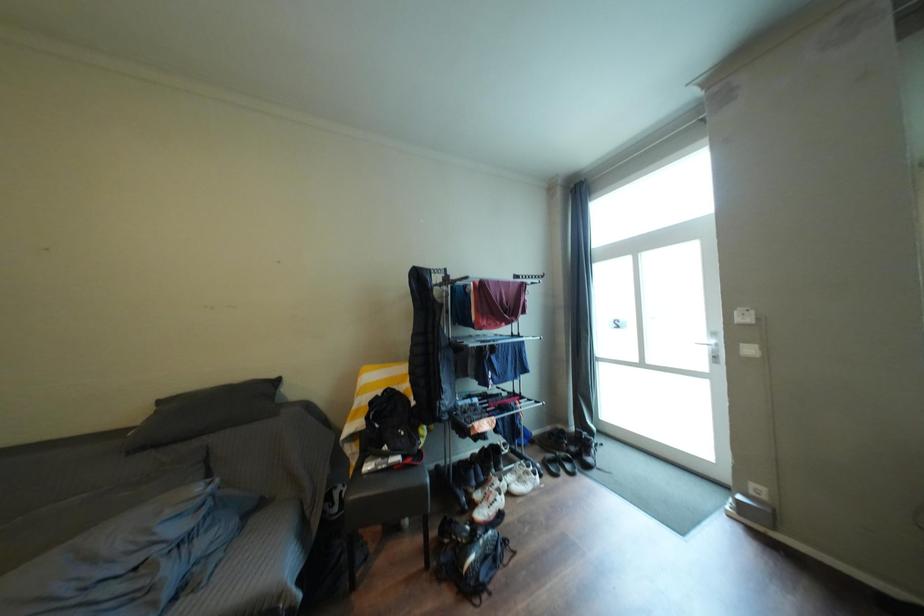
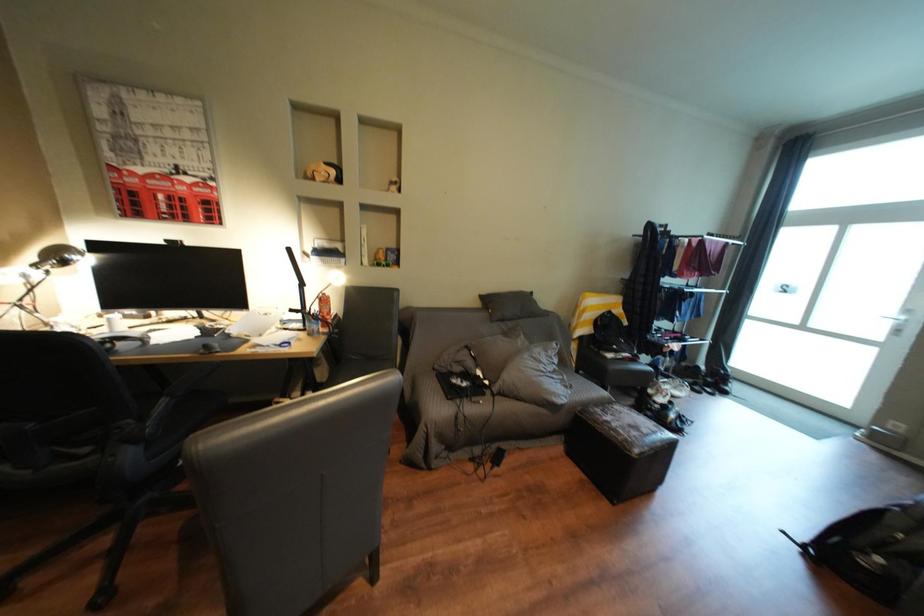
What movement of the cameraman would produce the second image?

The cameraman moved toward left, backward.